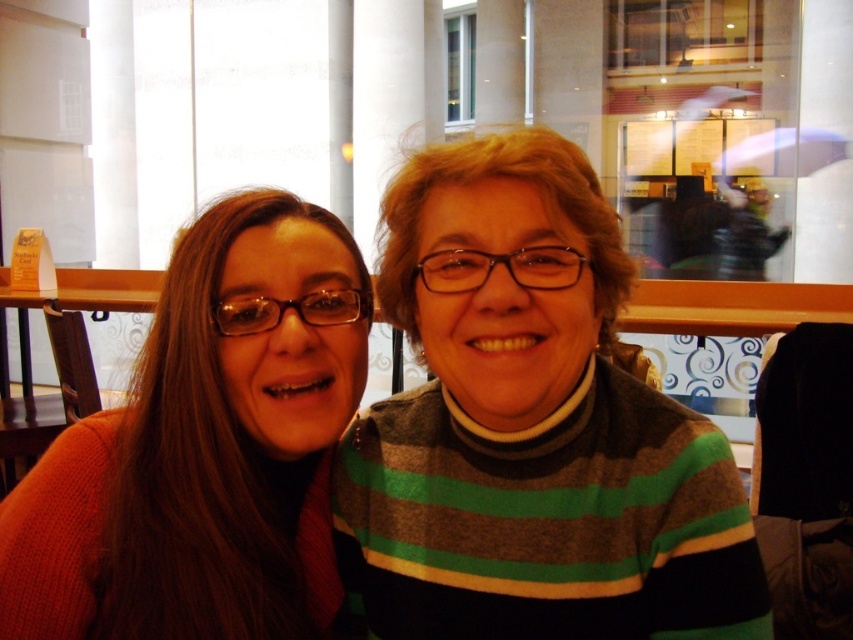
What do you see at coordinates (531, 428) in the screenshot?
I see `striped sweater at center` at bounding box center [531, 428].

Does striped sweater at center appear under knitted orange sweater at left?

No, striped sweater at center is not below knitted orange sweater at left.

I want to click on striped sweater at center, so click(x=531, y=428).